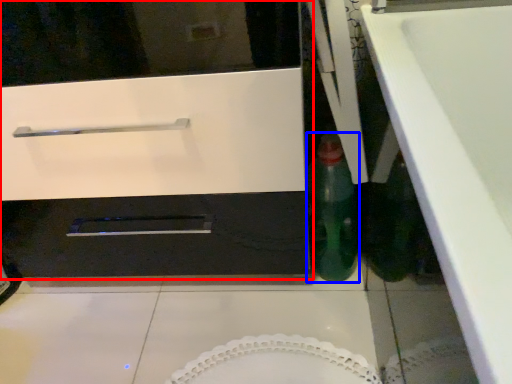
Question: Which of the following is the farthest to the observer, oven (highlighted by a red box) or bottle (highlighted by a blue box)?

Choices:
 (A) oven
 (B) bottle

Answer: (B)